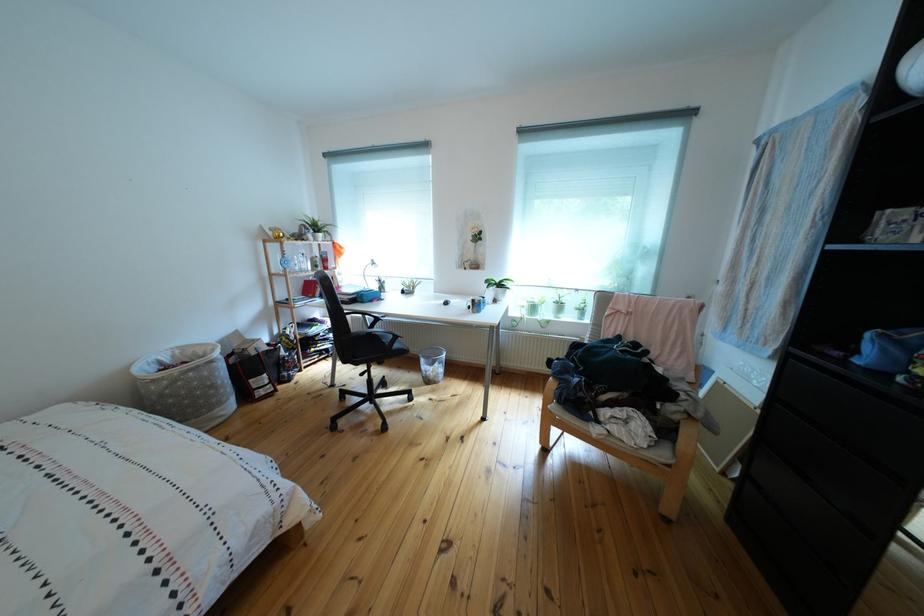
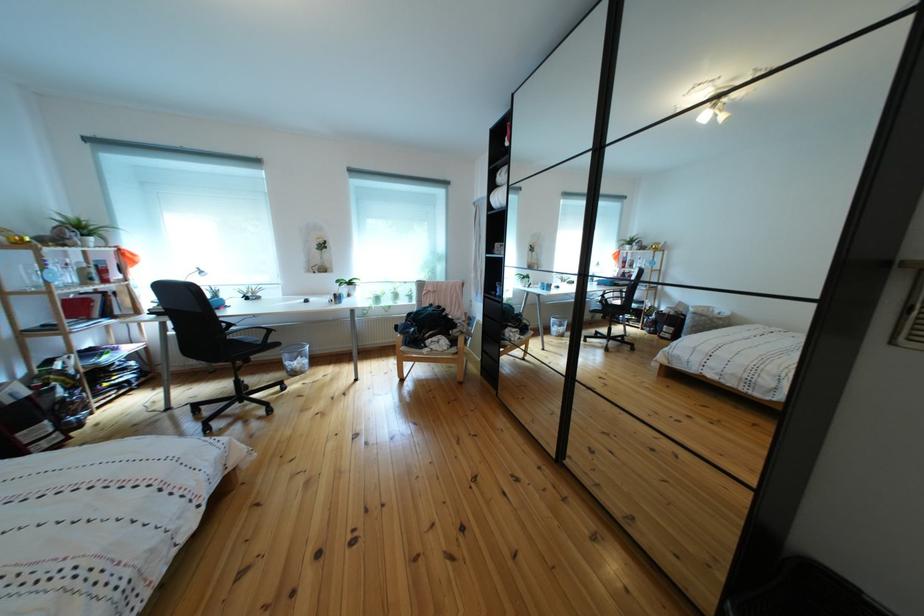
Find the pixel in the second image that matches pixel 433 367 in the first image.

(297, 362)